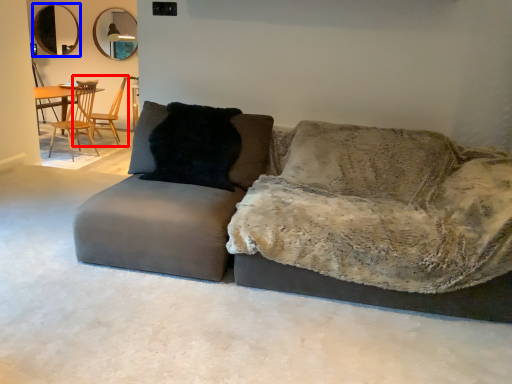
Question: Which point is closer to the camera, chair (highlighted by a red box) or mirror (highlighted by a blue box)?

Choices:
 (A) chair
 (B) mirror

Answer: (A)